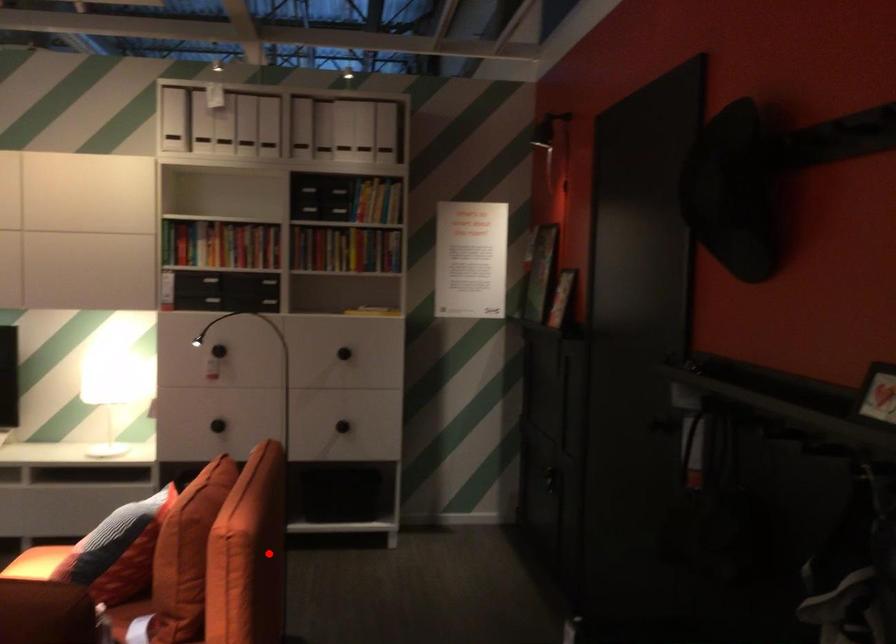
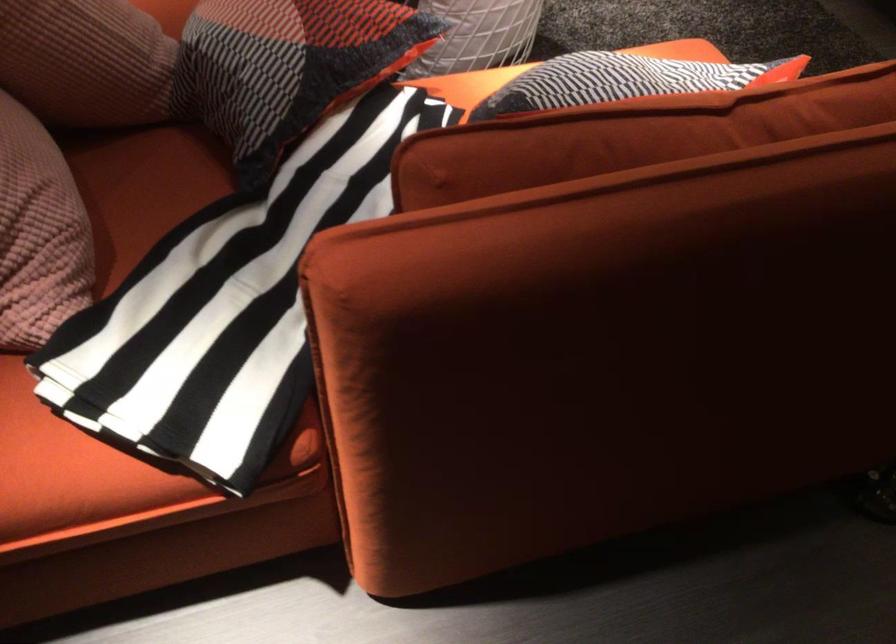
In the second image, find the point that corresponds to the highlighted location in the first image.

(605, 353)